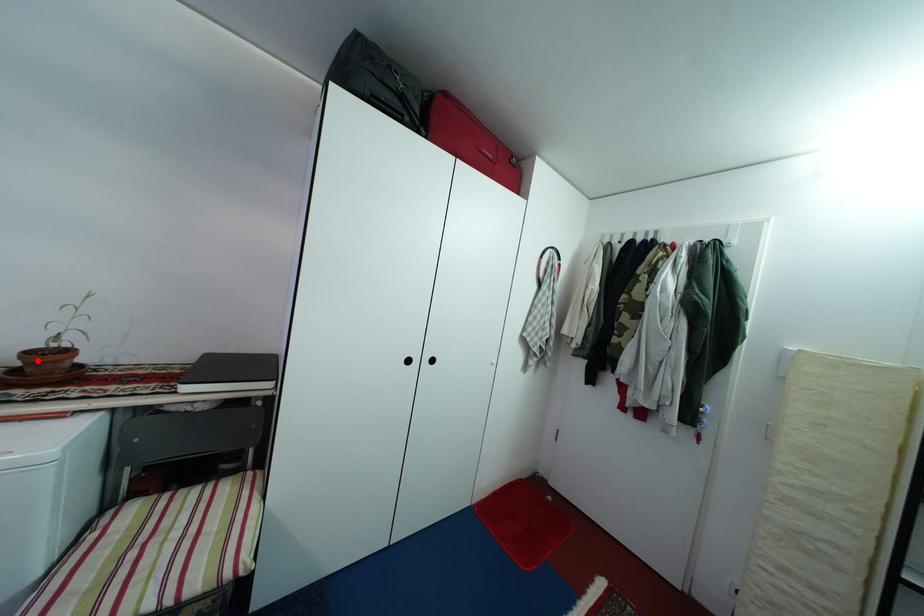
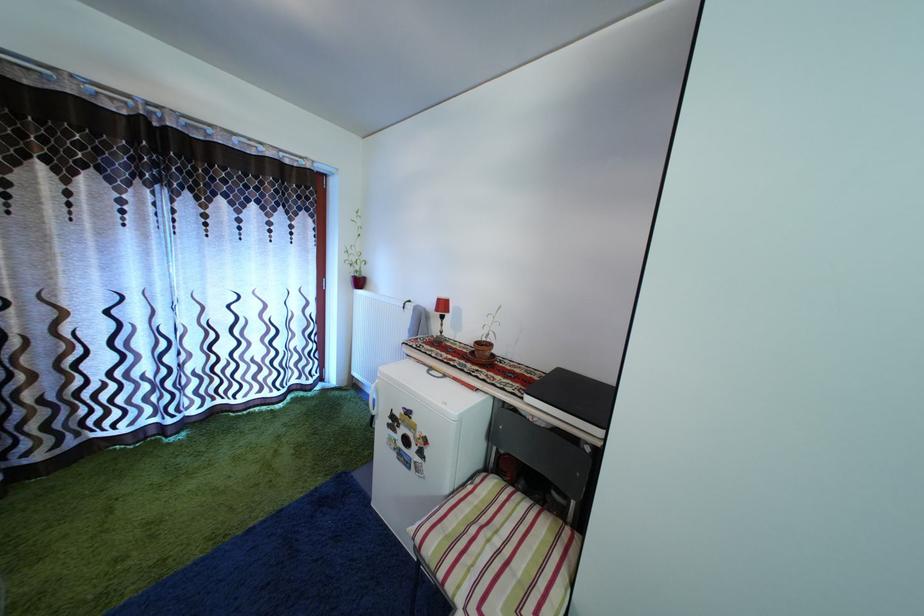
Question: A red point is marked in image1. In image2, is the corresponding 3D point closer to the camera or farther? Reply with the corresponding letter.

Choices:
 (A) The corresponding 3D point is closer.
 (B) The corresponding 3D point is farther.

Answer: (B)